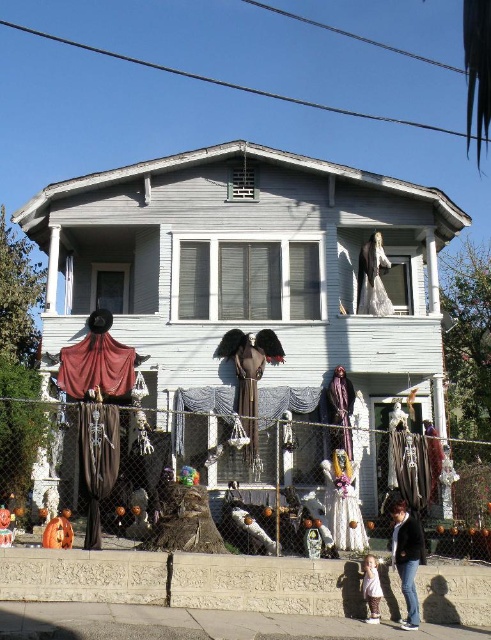
You are standing in front of the Halloween house and want to walk towards the two points marked on the image. Which point, point [406,588] or point [367,577], is closer to you?

Point [406,588] is in front of point [367,577], so it is closer to you.